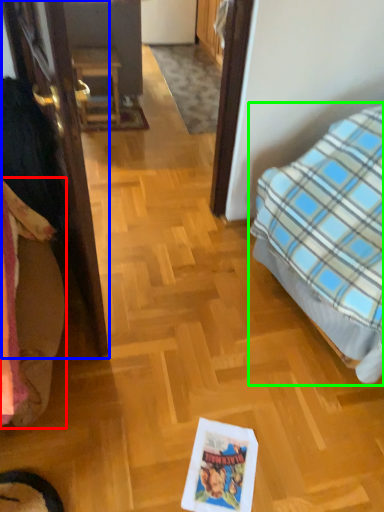
Question: Estimate the real-world distances between objects in this image. Which object is farther from bedding (highlighted by a red box), door (highlighted by a blue box) or bed (highlighted by a green box)?

Choices:
 (A) door
 (B) bed

Answer: (B)